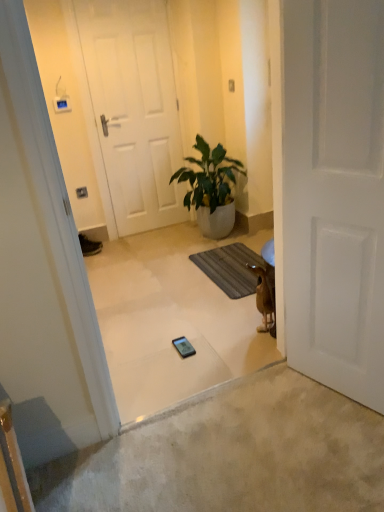
I want to click on vacant area that lies in front of white matte door at center, the 1th door from the left, so click(144, 244).